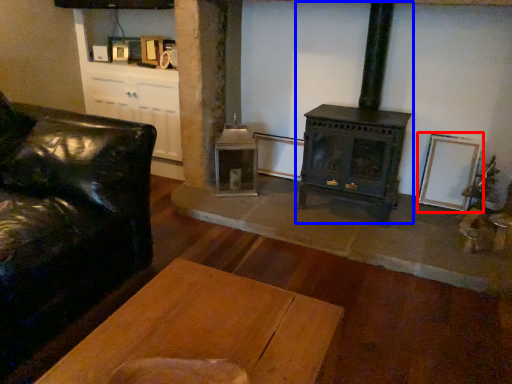
Question: Among these objects, which one is farthest to the camera, picture frame (highlighted by a red box) or wood burning stove (highlighted by a blue box)?

Choices:
 (A) picture frame
 (B) wood burning stove

Answer: (A)